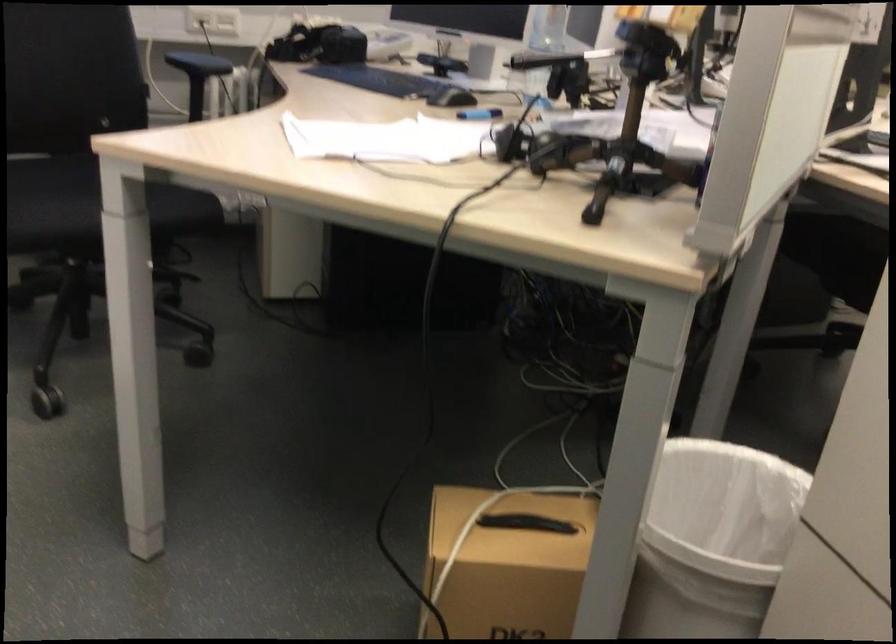
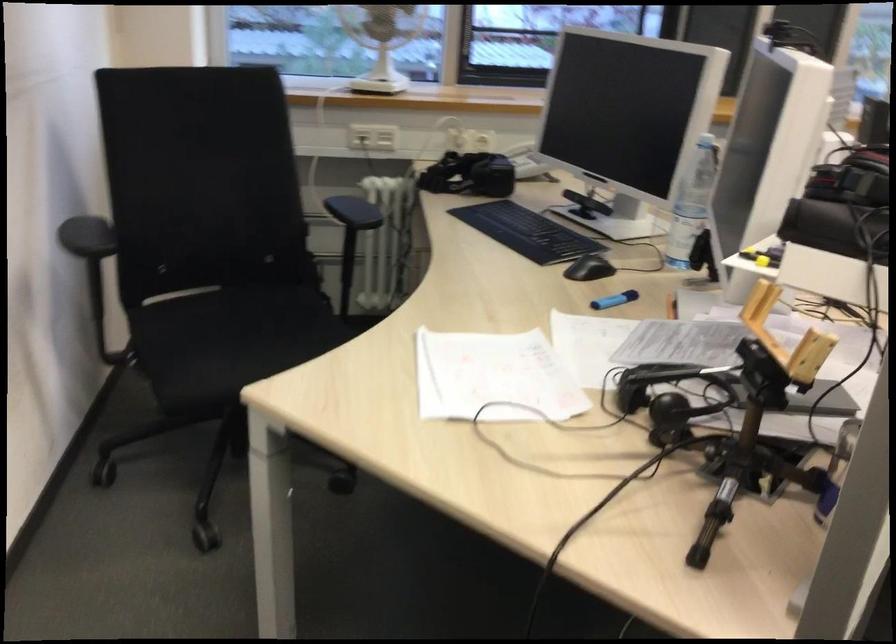
Locate, in the second image, the point that corresponds to point (451, 96) in the first image.

(589, 268)